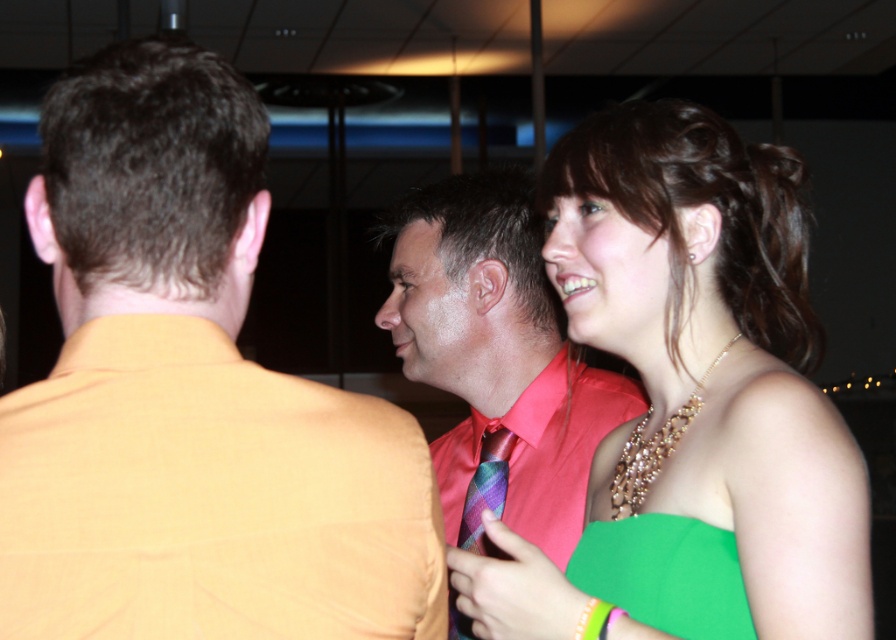
Which is behind, point (431, 365) or point (457, 625)?

The point (431, 365) is behind.

Can you confirm if shiny pink shirt at center is wider than multicolored striped tie at center?

Yes, shiny pink shirt at center is wider than multicolored striped tie at center.

Between point (444, 460) and point (484, 435), which one is positioned behind?

Positioned behind is point (444, 460).

What are the coordinates of `shiny pink shirt at center` in the screenshot? It's located at (496, 358).

Does orange fabric shirt at left come in front of green satin dress at center?

Yes, orange fabric shirt at left is closer to the viewer.

Can you confirm if orange fabric shirt at left is wider than green satin dress at center?

No, orange fabric shirt at left is not wider than green satin dress at center.

Locate an element on the screen. orange fabric shirt at left is located at coordinates pos(190,396).

Identify the location of orange fabric shirt at left. (190, 396).

Can you confirm if green satin dress at center is positioned below multicolored striped tie at center?

Actually, green satin dress at center is above multicolored striped tie at center.

Who is lower down, green satin dress at center or multicolored striped tie at center?

Positioned lower is multicolored striped tie at center.

You are a GUI agent. You are given a task and a screenshot of the screen. Output one action in this format:
    pyautogui.click(x=<x>, y=<y>)
    Task: Click on the green satin dress at center
    The height and width of the screenshot is (640, 896).
    Given the screenshot: What is the action you would take?
    pyautogui.click(x=712, y=353)